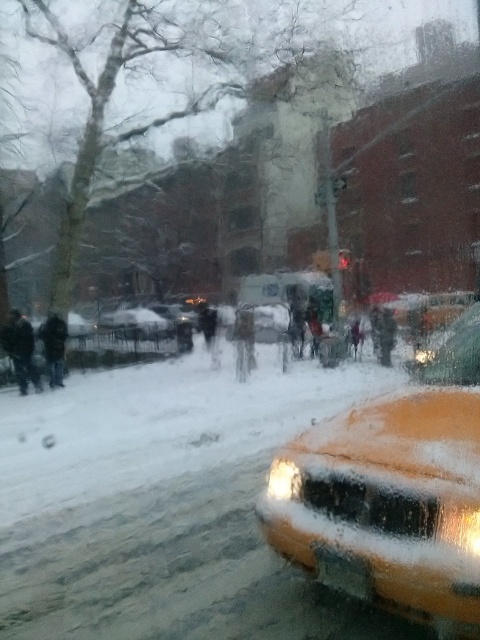
You are a delivery person who needs to place a package between the dark brown fur coat at center and the dark gray fabric coat at center. The package requires 3 meters of space. Is there enough space between them?

The dark brown fur coat at center and dark gray fabric coat at center are 4.57 meters apart from each other. Since the required space is 3 meters, there is enough space between them to place the package.